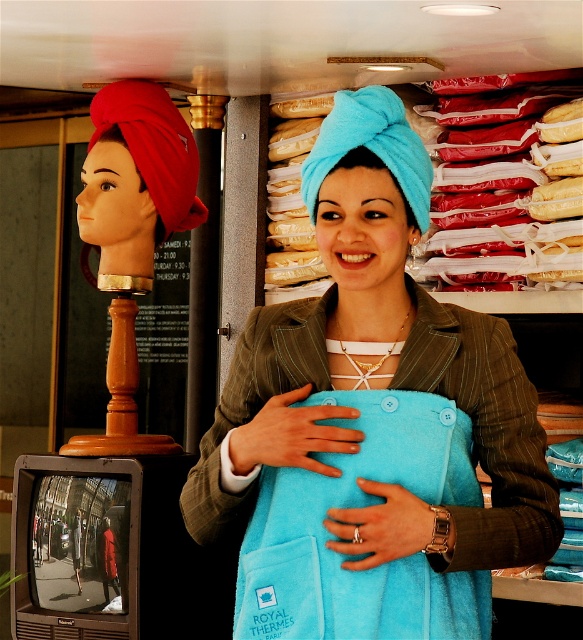
You are a customer in the store and want to find the turquoise towel at center. According to the store layout, where should you look relative to the woman in the green pinstriped blazer?

The turquoise towel at center is located at point (x=371, y=422), which is to the right and slightly forward of the woman in the green pinstriped blazer.

You are a customer in the store and want to know which item is shorter between the turquoise fleece apron at center and the red fabric head at left. Can you tell me?

The turquoise fleece apron at center has a lesser height compared to the red fabric head at left, so the turquoise fleece apron at center is shorter.